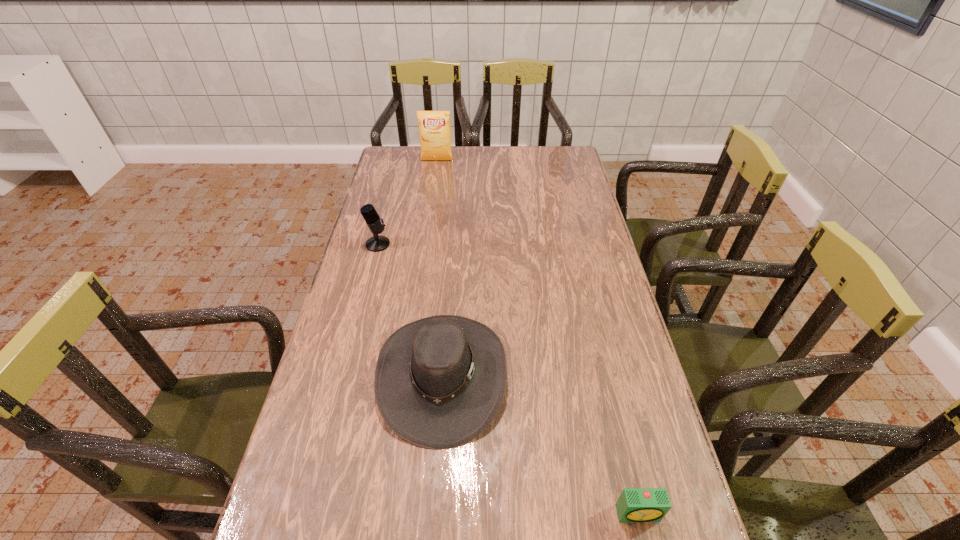
Identify the location of free space between the second nearest object and the farthest object. (440, 268).

Locate an element on the screen. vacant space that is in between the leftmost object and the shortest object is located at coordinates (508, 379).

Locate an element on the screen. vacant point located between the third nearest object and the tallest object is located at coordinates (407, 202).

At what (x,y) coordinates should I click in order to perform the action: click on empty space between the tallest object and the third nearest object. Please return your answer as a coordinate pair (x, y). This screenshot has height=540, width=960. Looking at the image, I should click on click(x=407, y=202).

You are a GUI agent. You are given a task and a screenshot of the screen. Output one action in this format:
    pyautogui.click(x=<x>, y=<y>)
    Task: Click on the vacant point located between the cowboy hat and the third nearest object
    The height and width of the screenshot is (540, 960).
    Given the screenshot: What is the action you would take?
    pyautogui.click(x=410, y=310)

Identify the location of empty space between the crisp (potato chip) and the leftmost object. (407, 202).

What are the coordinates of `unoccupied position between the nearest object and the tallest object` in the screenshot? It's located at (538, 337).

Identify the location of vacant space in between the tallest object and the nearest object. This screenshot has width=960, height=540. (538, 337).

Locate an element on the screen. blank region between the second nearest object and the crisp (potato chip) is located at coordinates (440, 268).

In order to click on vacant area between the farthest object and the alarm clock in this screenshot , I will do `click(538, 337)`.